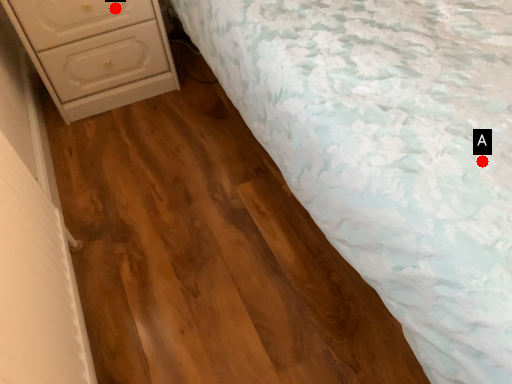
Question: Two points are circled on the image, labeled by A and B beside each circle. Which point is closer to the camera?

Choices:
 (A) A is closer
 (B) B is closer

Answer: (A)